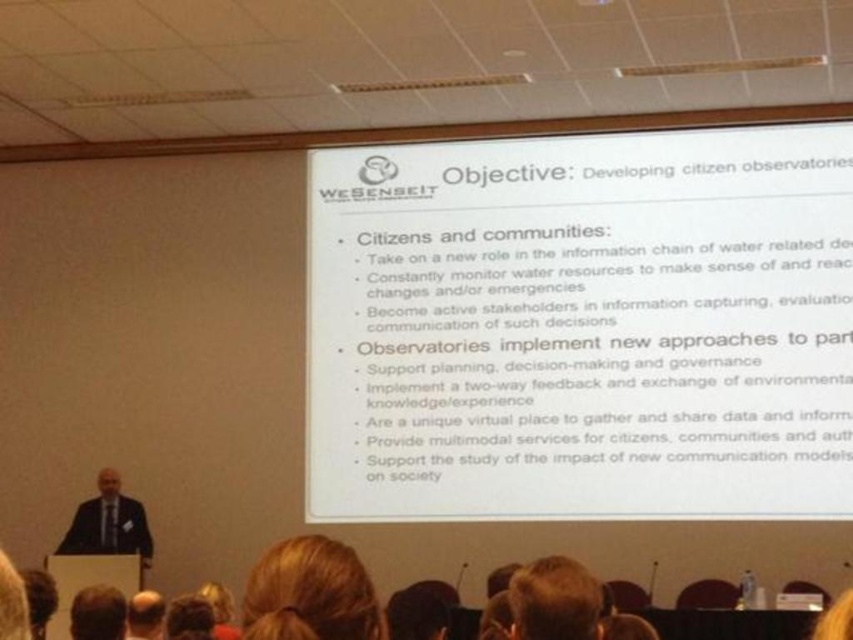
Who is shorter, blonde hair at upper center or brown hair at upper center?

With less height is brown hair at upper center.

Is blonde hair at upper center smaller than brown hair at upper center?

No.

Locate an element on the screen. blonde hair at upper center is located at coordinates (554, 600).

Who is more forward, (376, 616) or (107, 522)?

Point (376, 616) is more forward.

Can you confirm if blonde hair at lower center is positioned below dark suit at lower left?

No.

The width and height of the screenshot is (853, 640). Find the location of `blonde hair at lower center`. blonde hair at lower center is located at coordinates (310, 593).

You are a GUI agent. You are given a task and a screenshot of the screen. Output one action in this format:
    pyautogui.click(x=<x>, y=<y>)
    Task: Click on the blonde hair at lower center
    The image size is (853, 640).
    Given the screenshot: What is the action you would take?
    pyautogui.click(x=310, y=593)

Does point (735, 256) come farther from viewer compared to point (361, 637)?

Yes.

Where is `white paper at center`? white paper at center is located at coordinates (582, 326).